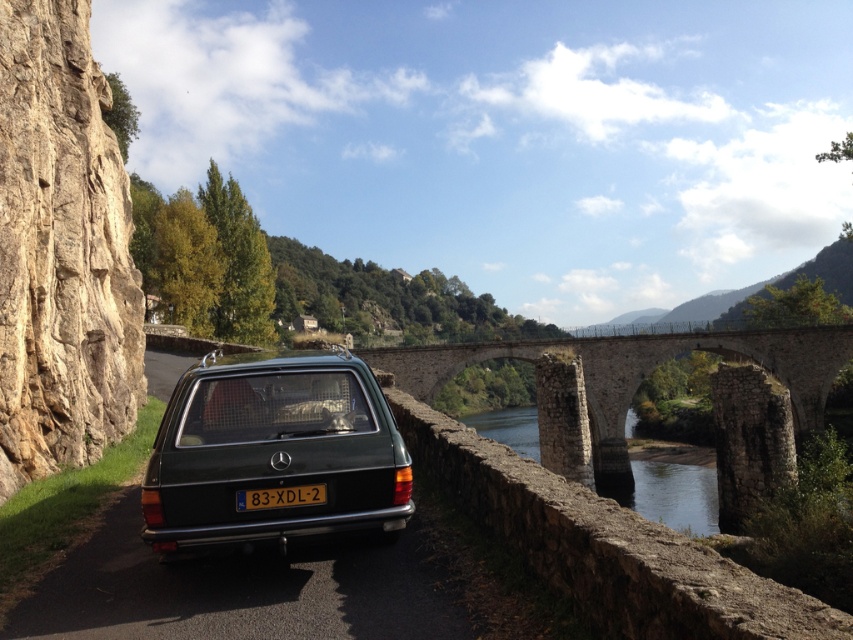
Question: Can you confirm if metallic green station wagon at center is positioned above black plastic license plate at center?

Choices:
 (A) no
 (B) yes

Answer: (A)

Question: Considering the relative positions of metallic green station wagon at center and black plastic license plate at center in the image provided, where is metallic green station wagon at center located with respect to black plastic license plate at center?

Choices:
 (A) above
 (B) below

Answer: (B)

Question: Does metallic green station wagon at center appear under black plastic license plate at center?

Choices:
 (A) no
 (B) yes

Answer: (B)

Question: Which object is positioned closest to the metallic green station wagon at center?

Choices:
 (A) black plastic license plate at center
 (B) clear stone water at center
 (C) stone arch bridge at center

Answer: (A)

Question: Which point is farther to the camera?

Choices:
 (A) (335, 428)
 (B) (384, 364)

Answer: (B)

Question: Which object appears closest to the camera in this image?

Choices:
 (A) stone arch bridge at center
 (B) clear stone water at center
 (C) black plastic license plate at center

Answer: (C)